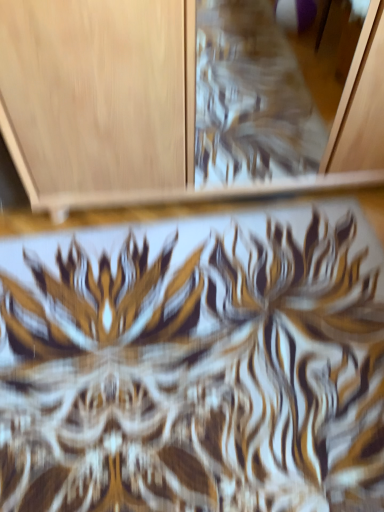
The height and width of the screenshot is (512, 384). I want to click on gold and white floral fabric at center, so click(195, 365).

Describe the element at coordinates (195, 365) in the screenshot. The image size is (384, 512). I see `gold and white floral fabric at center` at that location.

Locate an element on the screen. The width and height of the screenshot is (384, 512). gold and white floral fabric at center is located at coordinates (195, 365).